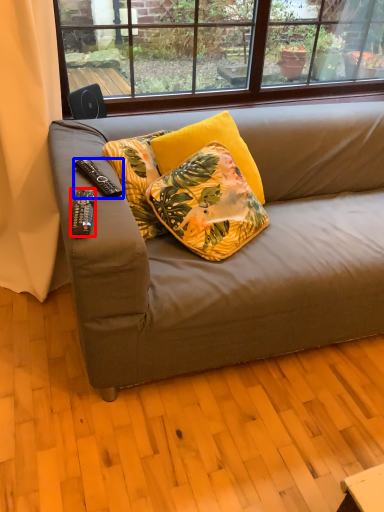
Question: Which of the following is the closest to the observer, remote control (highlighted by a red box) or remote control (highlighted by a blue box)?

Choices:
 (A) remote control
 (B) remote control

Answer: (A)